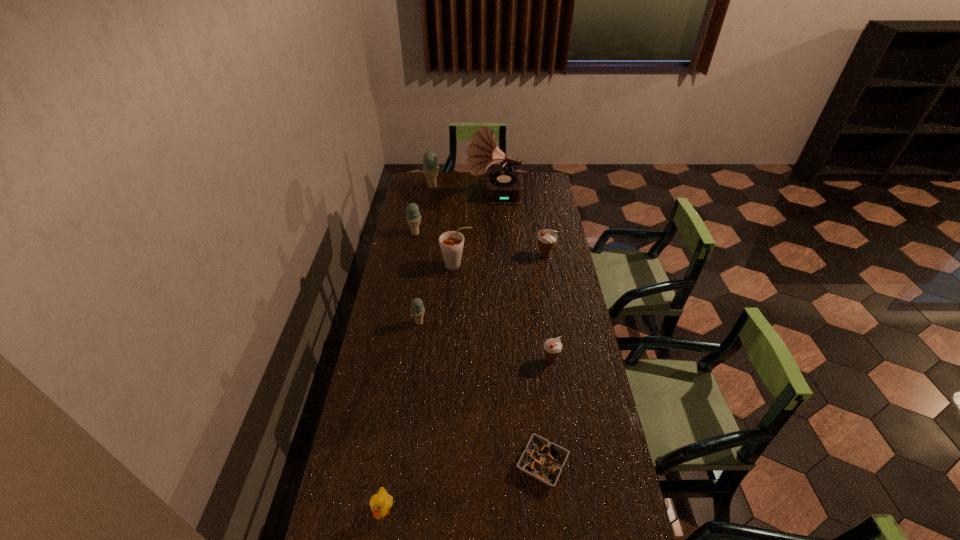
You are a GUI agent. You are given a task and a screenshot of the screen. Output one action in this format:
    pyautogui.click(x=<x>, y=<y>)
    Task: Click on the ashtray that is positioned at the right edge
    The image size is (960, 540).
    Given the screenshot: What is the action you would take?
    pyautogui.click(x=543, y=460)

Locate an element on the screen. The height and width of the screenshot is (540, 960). object that is positioned at the far left corner is located at coordinates (430, 168).

At what (x,y) coordinates should I click in order to perform the action: click on vacant area at the far edge. Please return your answer as a coordinate pair (x, y). Looking at the image, I should click on (479, 188).

This screenshot has width=960, height=540. Identify the location of vacant space at the left edge. (386, 484).

Locate an element on the screen. free space at the right edge of the desktop is located at coordinates (621, 496).

Locate an element on the screen. This screenshot has height=540, width=960. vacant area that lies between the nearer white icecream and the tallest ice cream is located at coordinates (492, 273).

Locate an element on the screen. This screenshot has width=960, height=540. free spot between the eighth farthest object and the third nearest ice cream is located at coordinates (543, 360).

This screenshot has width=960, height=540. What are the coordinates of `free space between the nearest blue ice cream and the root beer` in the screenshot? It's located at (438, 294).

Where is `vacant area that lies between the third farthest object and the bigger white icecream`? This screenshot has height=540, width=960. vacant area that lies between the third farthest object and the bigger white icecream is located at coordinates (480, 245).

This screenshot has height=540, width=960. Identify the location of free space between the duckling and the bigger white icecream. (464, 384).